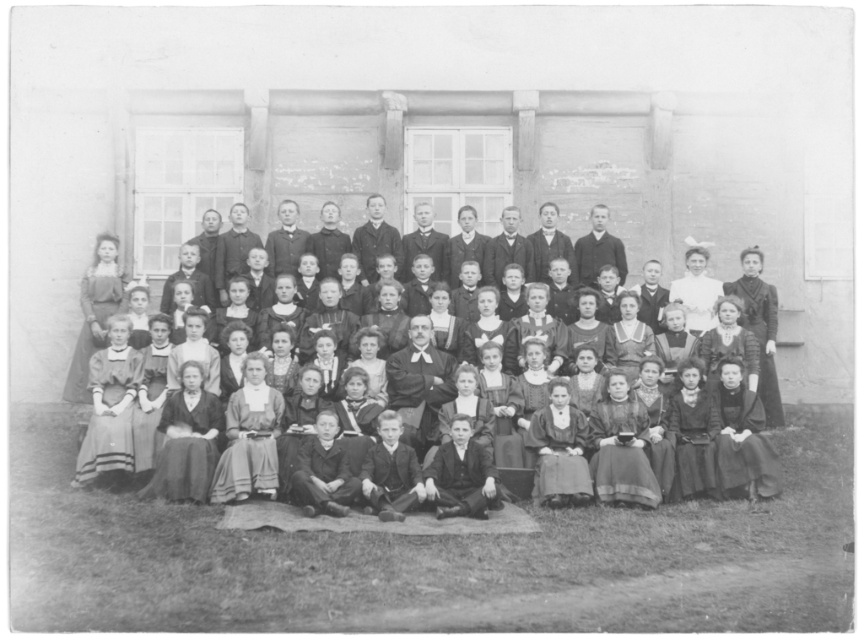
Question: Considering the real-world distances, which object is closest to the white satin blouse at upper center?

Choices:
 (A) matte brown dress at upper left
 (B) matte black dress at upper right

Answer: (B)

Question: Which object is farther from the camera taking this photo?

Choices:
 (A) matte brown dress at upper left
 (B) matte black dress at upper right
 (C) white satin blouse at upper center

Answer: (C)

Question: Is matte black dress at upper right behind white satin blouse at upper center?

Choices:
 (A) yes
 (B) no

Answer: (B)

Question: Which point is closer to the camera?

Choices:
 (A) (741, 289)
 (B) (100, 337)

Answer: (B)

Question: From the image, what is the correct spatial relationship of matte brown dress at upper left in relation to white satin blouse at upper center?

Choices:
 (A) right
 (B) left

Answer: (B)

Question: Can you confirm if matte brown dress at upper left is wider than matte black dress at upper right?

Choices:
 (A) yes
 (B) no

Answer: (B)